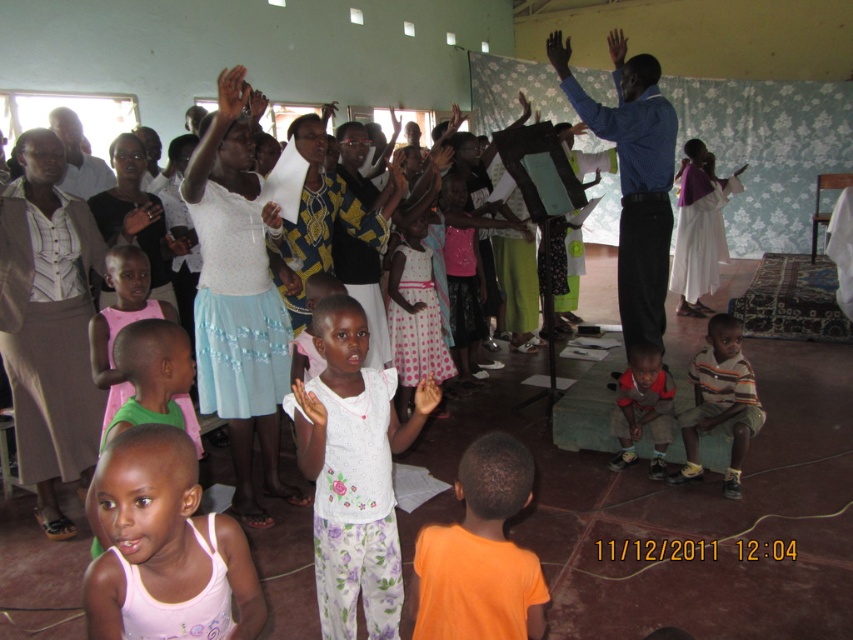
From the picture: Does orange t-shirt at lower center have a greater width compared to pink dotted dress at center?

No.

Describe the element at coordinates (480, 554) in the screenshot. I see `orange t-shirt at lower center` at that location.

Describe the element at coordinates (480, 554) in the screenshot. I see `orange t-shirt at lower center` at that location.

Where is `orange t-shirt at lower center`? orange t-shirt at lower center is located at coordinates (480, 554).

In the scene shown: Between pink cotton tank top at lower left and pink fabric dress at lower left, which one appears on the right side from the viewer's perspective?

pink cotton tank top at lower left is more to the right.

Is pink cotton tank top at lower left further to the viewer compared to pink fabric dress at lower left?

No, pink cotton tank top at lower left is in front of pink fabric dress at lower left.

Between point (218, 612) and point (129, 282), which one is positioned in front?

Point (218, 612)

Locate an element on the screen. pink cotton tank top at lower left is located at coordinates (165, 548).

Who is more distant from viewer, (654, 209) or (227, 108)?

Positioned behind is point (654, 209).

Image resolution: width=853 pixels, height=640 pixels. I want to click on blue shirt at center, so click(x=637, y=188).